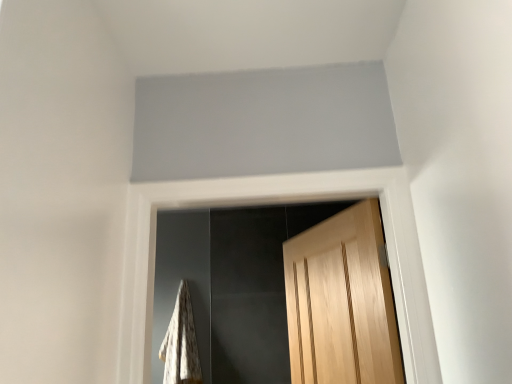
Question: Considering the positions of point (366, 243) and point (180, 337), is point (366, 243) closer or farther from the camera than point (180, 337)?

Choices:
 (A) farther
 (B) closer

Answer: (B)

Question: Considering their positions, is light brown wood door at center located in front of or behind white textured blanket at lower left?

Choices:
 (A) front
 (B) behind

Answer: (A)

Question: From a real-world perspective, relative to white textured blanket at lower left, is light brown wood door at center vertically above or below?

Choices:
 (A) below
 (B) above

Answer: (B)

Question: In terms of size, does white textured blanket at lower left appear bigger or smaller than light brown wood door at center?

Choices:
 (A) big
 (B) small

Answer: (B)

Question: Relative to light brown wood door at center, is white textured blanket at lower left in front or behind?

Choices:
 (A) behind
 (B) front

Answer: (A)

Question: From a real-world perspective, is white textured blanket at lower left above or below light brown wood door at center?

Choices:
 (A) below
 (B) above

Answer: (A)

Question: Is point (164, 377) positioned closer to the camera than point (311, 339)?

Choices:
 (A) closer
 (B) farther

Answer: (B)